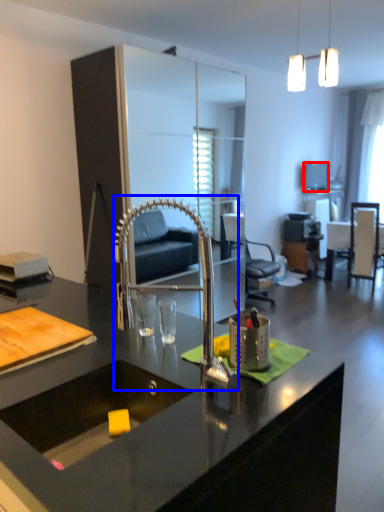
Question: Which of the following is the closest to the observer, television (highlighted by a red box) or faucet (highlighted by a blue box)?

Choices:
 (A) television
 (B) faucet

Answer: (B)